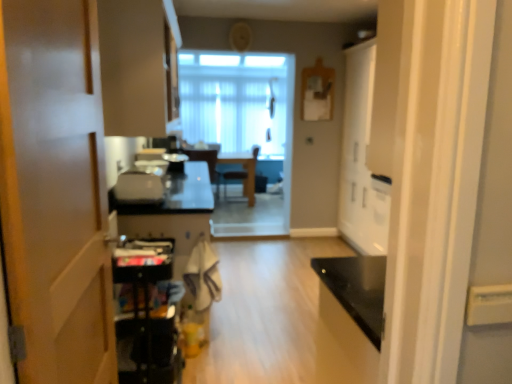
Question: Is translucent glass window at center facing away from metallic black cart at lower left, marked as the third appliance in a back-to-front arrangement?

Choices:
 (A) yes
 (B) no

Answer: (B)

Question: Considering the relative sizes of translucent glass window at center and metallic black cart at lower left, placed as the first appliance when sorted from front to back, in the image provided, is translucent glass window at center taller than metallic black cart at lower left, placed as the first appliance when sorted from front to back,?

Choices:
 (A) yes
 (B) no

Answer: (A)

Question: Are translucent glass window at center and metallic black cart at lower left, which appears as the third appliance when viewed from the top, far apart?

Choices:
 (A) yes
 (B) no

Answer: (A)

Question: From a real-world perspective, is translucent glass window at center over metallic black cart at lower left, which appears as the third appliance when viewed from the top?

Choices:
 (A) yes
 (B) no

Answer: (A)

Question: Considering the relative sizes of translucent glass window at center and metallic black cart at lower left, positioned as the 1th appliance in bottom-to-top order, in the image provided, is translucent glass window at center smaller than metallic black cart at lower left, positioned as the 1th appliance in bottom-to-top order,?

Choices:
 (A) no
 (B) yes

Answer: (A)

Question: Does translucent glass window at center appear on the right side of metallic black cart at lower left, positioned as the 1th appliance in bottom-to-top order?

Choices:
 (A) no
 (B) yes

Answer: (B)

Question: Does matte white chair at center, which is the 2th chair from right to left, have a lesser width compared to translucent glass window at center?

Choices:
 (A) no
 (B) yes

Answer: (A)

Question: Would you say matte white chair at center, which is the 2th chair from right to left, is outside translucent glass window at center?

Choices:
 (A) yes
 (B) no

Answer: (A)

Question: From the image's perspective, is matte white chair at center, which is the 2th chair from right to left, located beneath translucent glass window at center?

Choices:
 (A) no
 (B) yes

Answer: (B)

Question: Considering the relative positions of matte white chair at center, which is the first chair in left-to-right order, and translucent glass window at center in the image provided, is matte white chair at center, which is the first chair in left-to-right order, to the left of translucent glass window at center from the viewer's perspective?

Choices:
 (A) no
 (B) yes

Answer: (B)

Question: Does matte white chair at center, which is the 2th chair from right to left, have a greater width compared to translucent glass window at center?

Choices:
 (A) no
 (B) yes

Answer: (B)

Question: Considering the relative positions of matte white chair at center, which is the 2th chair from right to left, and translucent glass window at center in the image provided, is matte white chair at center, which is the 2th chair from right to left, behind translucent glass window at center?

Choices:
 (A) yes
 (B) no

Answer: (B)

Question: Is the depth of translucent glass window at center less than that of matte beige cabinet at upper left?

Choices:
 (A) yes
 (B) no

Answer: (B)